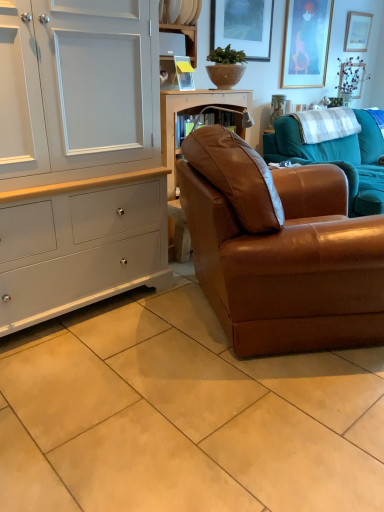
Question: From the image's perspective, is brown leather couch at center, the first studio couch when ordered from back to front, under wooden picture frame at upper right, which is the third picture frame in front-to-back order?

Choices:
 (A) yes
 (B) no

Answer: (A)

Question: Is brown leather couch at center, the first studio couch when ordered from back to front, positioned in front of wooden picture frame at upper right, which is the third picture frame in front-to-back order?

Choices:
 (A) no
 (B) yes

Answer: (B)

Question: From a real-world perspective, is brown leather couch at center, the first studio couch when ordered from back to front, under wooden picture frame at upper right, the 3th picture frame positioned from the left?

Choices:
 (A) no
 (B) yes

Answer: (B)

Question: Is brown leather couch at center, placed as the 2th studio couch when sorted from front to back, outside wooden picture frame at upper right, which appears as the 1th picture frame when viewed from the back?

Choices:
 (A) no
 (B) yes

Answer: (B)

Question: From the image's perspective, is brown leather couch at center, placed as the 2th studio couch when sorted from front to back, over wooden picture frame at upper right, which is the third picture frame in front-to-back order?

Choices:
 (A) no
 (B) yes

Answer: (A)

Question: From a real-world perspective, is brown leather couch at center, the first studio couch when ordered from back to front, located higher than wooden picture frame at upper right, the 1th picture frame in the right-to-left sequence?

Choices:
 (A) no
 (B) yes

Answer: (A)

Question: Is green matte vase at upper right aimed at gold-framed picture at upper right, which is the 2th picture frame from front to back?

Choices:
 (A) yes
 (B) no

Answer: (B)

Question: Is green matte vase at upper right oriented away from gold-framed picture at upper right, marked as the 2th picture frame in a back-to-front arrangement?

Choices:
 (A) no
 (B) yes

Answer: (A)

Question: Can you confirm if green matte vase at upper right is thinner than gold-framed picture at upper right, arranged as the second picture frame when viewed from the left?

Choices:
 (A) no
 (B) yes

Answer: (B)

Question: Is gold-framed picture at upper right, which is the 2th picture frame from front to back, located within green matte vase at upper right?

Choices:
 (A) yes
 (B) no

Answer: (B)

Question: From a real-world perspective, does green matte vase at upper right sit lower than gold-framed picture at upper right, which is the 2th picture frame from front to back?

Choices:
 (A) yes
 (B) no

Answer: (A)

Question: Considering the relative positions of green matte vase at upper right and gold-framed picture at upper right, marked as the 2th picture frame in a back-to-front arrangement, in the image provided, is green matte vase at upper right to the right of gold-framed picture at upper right, marked as the 2th picture frame in a back-to-front arrangement, from the viewer's perspective?

Choices:
 (A) yes
 (B) no

Answer: (A)

Question: From a real-world perspective, is beige ceramic tile at lower center over white plastic shelf at upper center, marked as the 2th shelf in a top-to-bottom arrangement?

Choices:
 (A) no
 (B) yes

Answer: (A)